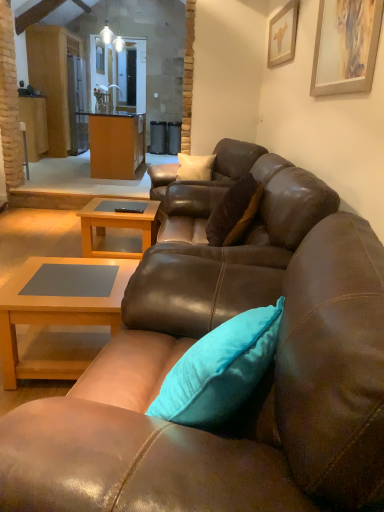
Measure the distance between point (269, 33) and camera.

Point (269, 33) and camera are 15.39 feet apart from each other.

Measure the distance between brown leather couch at center, which ranks as the 1th studio couch in bottom-to-top order, and camera.

A distance of 64.26 centimeters exists between brown leather couch at center, which ranks as the 1th studio couch in bottom-to-top order, and camera.

The image size is (384, 512). What do you see at coordinates (118, 227) in the screenshot? I see `light brown wood coffee table at center, the second coffee table from the front` at bounding box center [118, 227].

Measure the distance between light brown wood coffee table at lower left, which ranks as the 1th coffee table in front-to-back order, and camera.

The distance of light brown wood coffee table at lower left, which ranks as the 1th coffee table in front-to-back order, from camera is 5.65 feet.

Where is `light brown wood coffee table at lower left, which ranks as the 2th coffee table in top-to-bottom order`? The image size is (384, 512). light brown wood coffee table at lower left, which ranks as the 2th coffee table in top-to-bottom order is located at coordinates (54, 316).

At what (x,y) coordinates should I click in order to perform the action: click on wooden picture frame at upper right, which is the 1th picture frame from front to back. Please return your answer as a coordinate pair (x, y). Image resolution: width=384 pixels, height=512 pixels. Looking at the image, I should click on (345, 46).

Considering the sizes of objects brown leather couch at center, the 2th studio couch in the bottom-to-top sequence, and light brown wood coffee table at center, which is the second coffee table in bottom-to-top order, in the image provided, who is smaller, brown leather couch at center, the 2th studio couch in the bottom-to-top sequence, or light brown wood coffee table at center, which is the second coffee table in bottom-to-top order,?

Smaller between the two is light brown wood coffee table at center, which is the second coffee table in bottom-to-top order.

Is point (244, 175) more distant than point (136, 220)?

No, (244, 175) is in front of (136, 220).

Is brown leather couch at center, which ranks as the 1th studio couch in back-to-front order, at the right side of light brown wood coffee table at center, the second coffee table from the front?

Yes, brown leather couch at center, which ranks as the 1th studio couch in back-to-front order, is to the right of light brown wood coffee table at center, the second coffee table from the front.

Between brown leather couch at center, which ranks as the 1th studio couch in back-to-front order, and light brown wood coffee table at center, the second coffee table from the front, which one has larger width?

brown leather couch at center, which ranks as the 1th studio couch in back-to-front order, is wider.

I want to click on cabinetry located on the left of wooden picture frame at upper right, which is the 1th picture frame from front to back, so click(116, 144).

Which is more to the right, matte wood cabinet at center or wooden picture frame at upper right, acting as the second picture frame starting from the top?

wooden picture frame at upper right, acting as the second picture frame starting from the top.

From a real-world perspective, does matte wood cabinet at center sit lower than wooden picture frame at upper right, the 1th picture frame positioned from the bottom?

Correct, in the physical world, matte wood cabinet at center is lower than wooden picture frame at upper right, the 1th picture frame positioned from the bottom.

Is point (99, 160) closer to camera compared to point (332, 35)?

No, (99, 160) is further to viewer.

Who is taller, brown leather couch at center, the second studio couch viewed from the front, or matte wood cabinet at center?

Standing taller between the two is matte wood cabinet at center.

Who is bigger, brown leather couch at center, the 2th studio couch in the bottom-to-top sequence, or matte wood cabinet at center?

With larger size is matte wood cabinet at center.

Consider the image. Which is further, (174, 190) or (115, 120)?

The point (115, 120) is farther.

Are matte wood cabinet at center and light brown wood coffee table at center, the second coffee table from the front, located far from each other?

Indeed, matte wood cabinet at center is not near light brown wood coffee table at center, the second coffee table from the front.

Where is `cabinetry on the left of the light brown wood coffee table at center, which is the second coffee table in bottom-to-top order`? cabinetry on the left of the light brown wood coffee table at center, which is the second coffee table in bottom-to-top order is located at coordinates (116, 144).

Who is shorter, matte wood cabinet at center or light brown wood coffee table at center, the second coffee table from the front?

light brown wood coffee table at center, the second coffee table from the front.

From the image's perspective, which object appears higher, matte wood cabinet at center or light brown wood coffee table at center, the second coffee table from the front?

matte wood cabinet at center appears higher in the image.

Is brown leather couch at center, which ranks as the 1th studio couch in bottom-to-top order, bigger than brown leather couch at center, the 2th studio couch in the bottom-to-top sequence?

Indeed, brown leather couch at center, which ranks as the 1th studio couch in bottom-to-top order, has a larger size compared to brown leather couch at center, the 2th studio couch in the bottom-to-top sequence.

From the picture: Would you say brown leather couch at center, which appears as the 1th studio couch when viewed from the front, is to the left or to the right of brown leather couch at center, which ranks as the 1th studio couch in back-to-front order, in the picture?

From the image, it's evident that brown leather couch at center, which appears as the 1th studio couch when viewed from the front, is to the left of brown leather couch at center, which ranks as the 1th studio couch in back-to-front order.

Where is `studio couch in front of the brown leather couch at center, arranged as the first studio couch when viewed from the top`? This screenshot has height=512, width=384. studio couch in front of the brown leather couch at center, arranged as the first studio couch when viewed from the top is located at coordinates [x=241, y=410].

Is brown leather couch at center, which ranks as the 1th studio couch in bottom-to-top order, located outside brown leather couch at center, which ranks as the 1th studio couch in back-to-front order?

Yes, brown leather couch at center, which ranks as the 1th studio couch in bottom-to-top order, is not within brown leather couch at center, which ranks as the 1th studio couch in back-to-front order.

Does light brown wood coffee table at lower left, which ranks as the 1th coffee table in front-to-back order, have a larger size compared to brown leather couch at center, arranged as the first studio couch when viewed from the top?

No.

From a real-world perspective, which is physically above, light brown wood coffee table at lower left, arranged as the 2th coffee table when viewed from the back, or brown leather couch at center, the 2th studio couch in the bottom-to-top sequence?

brown leather couch at center, the 2th studio couch in the bottom-to-top sequence, from a real-world perspective.

Is light brown wood coffee table at lower left, arranged as the 2th coffee table when viewed from the back, taller or shorter than brown leather couch at center, which ranks as the 1th studio couch in back-to-front order?

Considering their sizes, light brown wood coffee table at lower left, arranged as the 2th coffee table when viewed from the back, has less height than brown leather couch at center, which ranks as the 1th studio couch in back-to-front order.

How different are the orientations of light brown wood coffee table at lower left, which ranks as the 2th coffee table in top-to-bottom order, and brown leather couch at center, which ranks as the 1th studio couch in back-to-front order, in degrees?

There is a 14.2-degree angle between the facing directions of light brown wood coffee table at lower left, which ranks as the 2th coffee table in top-to-bottom order, and brown leather couch at center, which ranks as the 1th studio couch in back-to-front order.

Does brown leather couch at center, arranged as the first studio couch when viewed from the top, turn towards brown leather couch at center, acting as the second studio couch starting from the top?

No, brown leather couch at center, arranged as the first studio couch when viewed from the top, is not oriented towards brown leather couch at center, acting as the second studio couch starting from the top.

Is brown leather couch at center, arranged as the first studio couch when viewed from the top, far from brown leather couch at center, which ranks as the 1th studio couch in bottom-to-top order?

Indeed, brown leather couch at center, arranged as the first studio couch when viewed from the top, is not near brown leather couch at center, which ranks as the 1th studio couch in bottom-to-top order.

Is brown leather couch at center, the 2th studio couch in the bottom-to-top sequence, in front of or behind brown leather couch at center, acting as the second studio couch starting from the top, in the image?

Visually, brown leather couch at center, the 2th studio couch in the bottom-to-top sequence, is located behind brown leather couch at center, acting as the second studio couch starting from the top.

Between brown leather couch at center, the 2th studio couch in the bottom-to-top sequence, and brown leather couch at center, which ranks as the 1th studio couch in bottom-to-top order, which one appears on the right side from the viewer's perspective?

From the viewer's perspective, brown leather couch at center, the 2th studio couch in the bottom-to-top sequence, appears more on the right side.

The width and height of the screenshot is (384, 512). Identify the location of the 2nd studio couch to the right when counting from the light brown wood coffee table at center, the second coffee table from the front. (203, 181).

Which picture frame is the 2nd one when counting from the front of the matte wood cabinet at center? Please provide its 2D coordinates.

[(345, 46)]

Which object lies nearer to the anchor point matte wood cabinet at center, light brown wood coffee table at center, the second coffee table from the front, or wooden picture frame at upper right, the 1th picture frame positioned from the bottom?

light brown wood coffee table at center, the second coffee table from the front, lies closer to matte wood cabinet at center than the other object.

Considering their positions, is brown leather swivel chair at center positioned further to light brown wood coffee table at center, which is the second coffee table in bottom-to-top order, than light brown wood coffee table at lower left, which ranks as the 2th coffee table in top-to-bottom order?

brown leather swivel chair at center is positioned further to the anchor light brown wood coffee table at center, which is the second coffee table in bottom-to-top order.

Considering their positions, is light brown wood coffee table at lower left, which is the 1th coffee table in bottom-to-top order, positioned further to light brown wood coffee table at center, which is the second coffee table in bottom-to-top order, than brown leather swivel chair at center?

Based on the image, brown leather swivel chair at center appears to be further to light brown wood coffee table at center, which is the second coffee table in bottom-to-top order.

Which object lies nearer to the anchor point wooden picture frame at upper right, which is the 2th picture frame in front-to-back order, light brown wood coffee table at lower left, which ranks as the 1th coffee table in front-to-back order, or brown leather couch at center, which ranks as the 1th studio couch in back-to-front order?

Among the two, brown leather couch at center, which ranks as the 1th studio couch in back-to-front order, is located nearer to wooden picture frame at upper right, which is the 2th picture frame in front-to-back order.

When comparing their distances from matte wood cabinet at center, does brown leather couch at center, the second studio couch viewed from the front, or brown leather swivel chair at center seem closer?

Among the two, brown leather couch at center, the second studio couch viewed from the front, is located nearer to matte wood cabinet at center.

Which object lies nearer to the anchor point brown leather swivel chair at center, brown leather couch at center, which ranks as the 1th studio couch in back-to-front order, or matte wood cabinet at center?

brown leather couch at center, which ranks as the 1th studio couch in back-to-front order, is positioned closer to the anchor brown leather swivel chair at center.

Based on their spatial positions, is wooden picture frame at upper right, the 1th picture frame positioned from the bottom, or brown leather couch at center, the 2th studio couch in the bottom-to-top sequence, closer to light brown wood coffee table at center, the 1th coffee table viewed from the back?

brown leather couch at center, the 2th studio couch in the bottom-to-top sequence, lies closer to light brown wood coffee table at center, the 1th coffee table viewed from the back, than the other object.

Looking at the image, which one is located closer to wooden picture frame at upper right, acting as the second picture frame starting from the top, light brown wood coffee table at lower left, which ranks as the 1th coffee table in front-to-back order, or wooden picture frame at upper right, placed as the first picture frame when sorted from top to bottom?

wooden picture frame at upper right, placed as the first picture frame when sorted from top to bottom, is positioned closer to the anchor wooden picture frame at upper right, acting as the second picture frame starting from the top.

Locate an element on the screen. This screenshot has height=512, width=384. picture frame between wooden picture frame at upper right, which is the 1th picture frame from front to back, and light brown wood coffee table at center, the 1th coffee table viewed from the back, in the front-back direction is located at coordinates (283, 34).

Where is `swivel chair between brown leather couch at center, which ranks as the 1th studio couch in bottom-to-top order, and matte wood cabinet at center, along the z-axis`? This screenshot has height=512, width=384. swivel chair between brown leather couch at center, which ranks as the 1th studio couch in bottom-to-top order, and matte wood cabinet at center, along the z-axis is located at coordinates 223,252.

Find the location of `picture frame between brown leather swivel chair at center and matte wood cabinet at center in the front-back direction`. picture frame between brown leather swivel chair at center and matte wood cabinet at center in the front-back direction is located at coordinates (283, 34).

I want to click on studio couch between wooden picture frame at upper right, acting as the first picture frame starting from the back, and light brown wood coffee table at lower left, which ranks as the 2th coffee table in top-to-bottom order, in the vertical direction, so click(x=203, y=181).